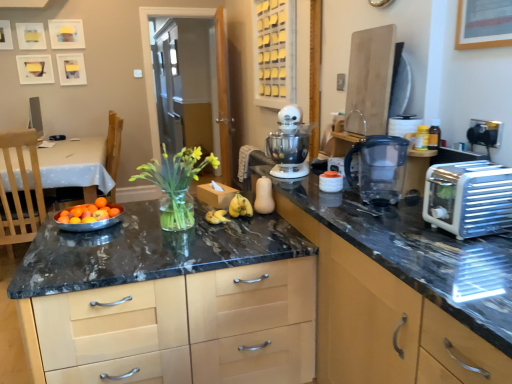
Where is `matte black countertop at center, which is the first cabinetry in bottom-to-top order`? This screenshot has height=384, width=512. matte black countertop at center, which is the first cabinetry in bottom-to-top order is located at coordinates click(x=135, y=271).

Describe the element at coordinates (135, 271) in the screenshot. Image resolution: width=512 pixels, height=384 pixels. I see `matte black countertop at center, which is the first cabinetry in bottom-to-top order` at that location.

At what (x,y) coordinates should I click in order to perform the action: click on white plastic toaster at right. Please return your answer as a coordinate pair (x, y). The width and height of the screenshot is (512, 384). Looking at the image, I should click on (468, 198).

What is the approximate width of white plastic toaster at right?

It is 11.86 inches.

Where is `yellow matte bananas at center`? The image size is (512, 384). yellow matte bananas at center is located at coordinates (231, 210).

Locate an element on the screen. This screenshot has height=384, width=512. matte black countertop at center, positioned as the 3th cabinetry in top-to-bottom order is located at coordinates (135, 271).

Does matte black toaster at right, which is the second cabinetry in bottom-to-top order, have a lesser height compared to yellow matte bananas at center?

In fact, matte black toaster at right, which is the second cabinetry in bottom-to-top order, may be taller than yellow matte bananas at center.

Is matte black toaster at right, the 2th cabinetry positioned from the top, in front of or behind yellow matte bananas at center in the image?

matte black toaster at right, the 2th cabinetry positioned from the top, is positioned closer to the viewer than yellow matte bananas at center.

Are matte black toaster at right, which is the second cabinetry in bottom-to-top order, and yellow matte bananas at center beside each other?

matte black toaster at right, which is the second cabinetry in bottom-to-top order, and yellow matte bananas at center are clearly separated.

Does matte black toaster at right, which is the second cabinetry in bottom-to-top order, contain yellow matte bananas at center?

Definitely not — yellow matte bananas at center is not inside matte black toaster at right, which is the second cabinetry in bottom-to-top order.

Is clear glass door at center at the right side of transparent plastic pitcher at right?

No.

Is clear glass door at center wider than transparent plastic pitcher at right?

No, clear glass door at center is not wider than transparent plastic pitcher at right.

Is clear glass door at center positioned far away from transparent plastic pitcher at right?

clear glass door at center is far away from transparent plastic pitcher at right.

How much distance is there between matte black toaster at right, the 2th cabinetry positioned from the top, and translucent glass vase at center?

A distance of 82.41 centimeters exists between matte black toaster at right, the 2th cabinetry positioned from the top, and translucent glass vase at center.

I want to click on the 1st cabinetry below the translucent glass vase at center (from the image's perspective), so click(385, 322).

Looking at their sizes, would you say matte black toaster at right, the 2th cabinetry positioned from the top, is wider or thinner than translucent glass vase at center?

Clearly, matte black toaster at right, the 2th cabinetry positioned from the top, has more width compared to translucent glass vase at center.

Between point (432, 372) and point (137, 169), which one is positioned in front?

The point (432, 372) is in front.

At what (x,y) coordinates should I click in order to perform the action: click on home appliance directly beneath the matte wood cabinet at upper center, which appears as the 1th cabinetry when viewed from the top (from a real-world perspective). Please return your answer as a coordinate pair (x, y). The image size is (512, 384). Looking at the image, I should click on (289, 144).

Considering the relative sizes of white plastic stand mixer at center and matte wood cabinet at upper center, which appears as the 1th cabinetry when viewed from the top, in the image provided, is white plastic stand mixer at center wider than matte wood cabinet at upper center, which appears as the 1th cabinetry when viewed from the top,?

Yes, white plastic stand mixer at center is wider than matte wood cabinet at upper center, which appears as the 1th cabinetry when viewed from the top.

Are white plastic stand mixer at center and matte wood cabinet at upper center, acting as the 3th cabinetry starting from the bottom, located far from each other?

Absolutely, white plastic stand mixer at center is distant from matte wood cabinet at upper center, acting as the 3th cabinetry starting from the bottom.

Considering the relative sizes of white plastic stand mixer at center and matte wood cabinet at upper center, acting as the 3th cabinetry starting from the bottom, in the image provided, is white plastic stand mixer at center shorter than matte wood cabinet at upper center, acting as the 3th cabinetry starting from the bottom,?

Indeed, white plastic stand mixer at center has a lesser height compared to matte wood cabinet at upper center, acting as the 3th cabinetry starting from the bottom.

Is clear glass door at center further to camera compared to white plastic toaster at right?

Yes, clear glass door at center is further from the viewer.

Can we say clear glass door at center lies outside white plastic toaster at right?

Yes, clear glass door at center is not within white plastic toaster at right.

From the image's perspective, between clear glass door at center and white plastic toaster at right, which one is located above?

clear glass door at center.

Is clear glass door at center oriented towards white plastic toaster at right?

Yes, clear glass door at center is oriented towards white plastic toaster at right.

This screenshot has width=512, height=384. Identify the location of home appliance that appears above the orange matte/orange at center (from a real-world perspective). coord(289,144).

Considering the relative positions of orange matte/orange at center and white plastic stand mixer at center in the image provided, is orange matte/orange at center behind white plastic stand mixer at center?

Yes, it is behind white plastic stand mixer at center.

Is point (100, 203) farther from viewer compared to point (295, 139)?

Yes, point (100, 203) is farther from viewer.

Looking at this image, from the image's perspective, is orange matte/orange at center located above white plastic stand mixer at center?

No, from the image's perspective, orange matte/orange at center is not on top of white plastic stand mixer at center.

Does point (140, 177) lie behind point (260, 31)?

No, (140, 177) is closer to viewer.

Who is smaller, translucent glass vase at center or matte wood cabinet at upper center, acting as the 3th cabinetry starting from the bottom?

With smaller size is translucent glass vase at center.

Is translucent glass vase at center taller than matte wood cabinet at upper center, acting as the 3th cabinetry starting from the bottom?

No, translucent glass vase at center is not taller than matte wood cabinet at upper center, acting as the 3th cabinetry starting from the bottom.

From the image's perspective, is translucent glass vase at center below matte wood cabinet at upper center, acting as the 3th cabinetry starting from the bottom?

Yes.

Where is `banana lying on the left of matte black toaster at right, which is the second cabinetry in bottom-to-top order`? banana lying on the left of matte black toaster at right, which is the second cabinetry in bottom-to-top order is located at coordinates (231, 210).

I want to click on kitchen appliance beneath the clear glass door at center (from a real-world perspective), so click(379, 168).

From the image, which object appears to be nearer to metallic silver bowl of mixed fruits at center-left, clear glass door at center or yellow matte bananas at center?

yellow matte bananas at center lies closer to metallic silver bowl of mixed fruits at center-left than the other object.

Looking at this image, looking at the image, which one is located further to white plastic toaster at right, translucent glass vase at center or wooden chair at left?

Among the two, wooden chair at left is located further to white plastic toaster at right.

Which object lies further to the anchor point translucent glass vase at center, white plastic toaster at right or matte wood cabinet at upper center, which appears as the 1th cabinetry when viewed from the top?

The object further to translucent glass vase at center is matte wood cabinet at upper center, which appears as the 1th cabinetry when viewed from the top.

Considering their positions, is translucent glass vase at center positioned further to white plastic stand mixer at center than matte black countertop at center, which is the first cabinetry in bottom-to-top order?

matte black countertop at center, which is the first cabinetry in bottom-to-top order, is further to white plastic stand mixer at center.

From the image, which object appears to be nearer to orange matte/orange at center, transparent plastic pitcher at right or white plastic stand mixer at center?

The object closer to orange matte/orange at center is white plastic stand mixer at center.

Based on their spatial positions, is metallic silver bowl of mixed fruits at center-left or orange matte/orange at center closer to yellow matte bananas at center?

Based on the image, metallic silver bowl of mixed fruits at center-left appears to be nearer to yellow matte bananas at center.

Looking at this image, considering their positions, is white plastic toaster at right positioned further to transparent plastic pitcher at right than matte black countertop at center, positioned as the 3th cabinetry in top-to-bottom order?

matte black countertop at center, positioned as the 3th cabinetry in top-to-bottom order.

Considering their positions, is matte black countertop at center, positioned as the 3th cabinetry in top-to-bottom order, positioned closer to orange matte/orange at center than translucent glass vase at center?

translucent glass vase at center is positioned closer to the anchor orange matte/orange at center.

Find the location of a particular element. floral arrangement between matte black countertop at center, which is the first cabinetry in bottom-to-top order, and white plastic toaster at right is located at coordinates (176, 184).

The image size is (512, 384). I want to click on orange between matte black toaster at right, which is the second cabinetry in bottom-to-top order, and matte wood cabinet at upper center, acting as the 3th cabinetry starting from the bottom, from front to back, so click(100, 202).

Locate an element on the screen. fruit situated between wooden chair at left and white plastic stand mixer at center from left to right is located at coordinates (88, 212).

What are the coordinates of `home appliance between translucent glass vase at center and transparent plastic pitcher at right in the horizontal direction` in the screenshot? It's located at (289, 144).